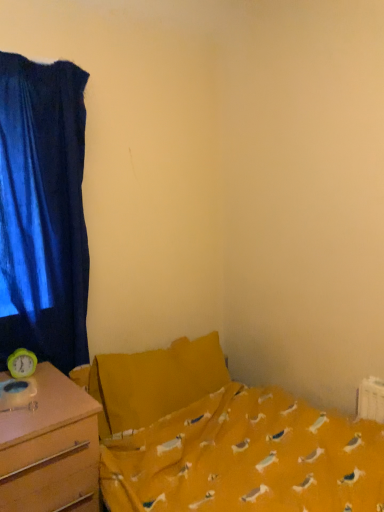
Question: Is yellow fabric bed at center to the left of velvet blue curtain at left from the viewer's perspective?

Choices:
 (A) yes
 (B) no

Answer: (B)

Question: Is yellow fabric bed at center not near velvet blue curtain at left?

Choices:
 (A) no
 (B) yes

Answer: (A)

Question: Does yellow fabric bed at center have a greater height compared to velvet blue curtain at left?

Choices:
 (A) yes
 (B) no

Answer: (B)

Question: From the image's perspective, is yellow fabric bed at center located above velvet blue curtain at left?

Choices:
 (A) no
 (B) yes

Answer: (A)

Question: Is yellow fabric bed at center positioned before velvet blue curtain at left?

Choices:
 (A) no
 (B) yes

Answer: (B)

Question: Looking at their shapes, would you say velvet blue curtain at left is wider or thinner than yellow fabric bed at center?

Choices:
 (A) wide
 (B) thin

Answer: (B)

Question: Is velvet blue curtain at left inside the boundaries of yellow fabric bed at center, or outside?

Choices:
 (A) outside
 (B) inside

Answer: (A)

Question: Considering the positions of velvet blue curtain at left and yellow fabric bed at center in the image, is velvet blue curtain at left taller or shorter than yellow fabric bed at center?

Choices:
 (A) tall
 (B) short

Answer: (A)

Question: From a real-world perspective, is velvet blue curtain at left physically located above or below yellow fabric bed at center?

Choices:
 (A) below
 (B) above

Answer: (B)

Question: From the image's perspective, is wooden desk at left positioned above or below velvet blue curtain at left?

Choices:
 (A) below
 (B) above

Answer: (A)

Question: Is point (14, 419) closer or farther from the camera than point (39, 352)?

Choices:
 (A) closer
 (B) farther

Answer: (A)

Question: Considering the positions of wooden desk at left and velvet blue curtain at left in the image, is wooden desk at left bigger or smaller than velvet blue curtain at left?

Choices:
 (A) big
 (B) small

Answer: (A)

Question: From their relative heights in the image, would you say wooden desk at left is taller or shorter than velvet blue curtain at left?

Choices:
 (A) short
 (B) tall

Answer: (A)

Question: Looking at their shapes, would you say yellow fabric bed at center is wider or thinner than wooden desk at left?

Choices:
 (A) thin
 (B) wide

Answer: (A)

Question: Which is correct: yellow fabric bed at center is inside wooden desk at left, or outside of it?

Choices:
 (A) outside
 (B) inside

Answer: (A)